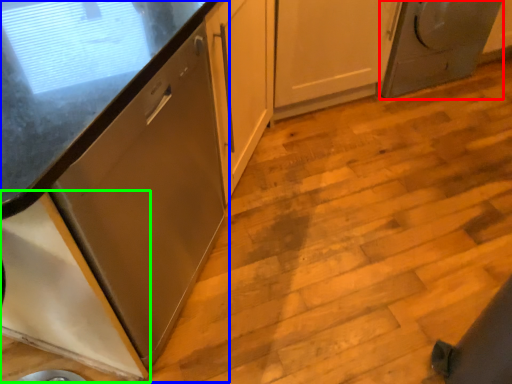
Question: Considering the real-world distances, which object is closest to home appliance (highlighted by a red box)? cabinetry (highlighted by a blue box) or cabinetry (highlighted by a green box).

Choices:
 (A) cabinetry
 (B) cabinetry

Answer: (A)